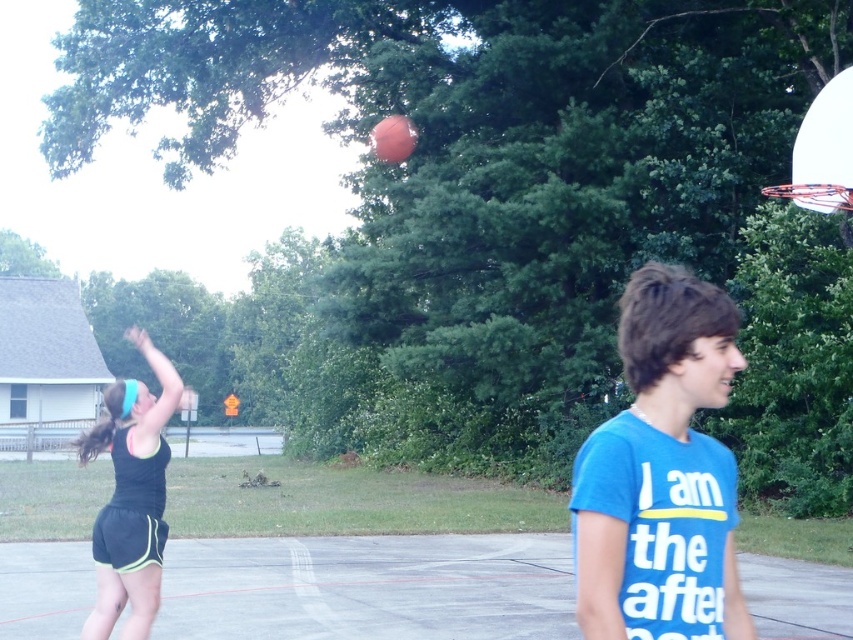
Is concrete court at center bigger than glossy orange basketball at upper center?

Yes.

Between point (566, 532) and point (369, 148), which one is positioned behind?

Point (369, 148)

Based on the photo, measure the distance between point (428, 550) and camera.

A distance of 15.06 meters exists between point (428, 550) and camera.

I want to click on concrete court at center, so click(x=369, y=588).

Who is taller, concrete court at center or white glossy basketball hoop at upper right?

concrete court at center is taller.

Between concrete court at center and white glossy basketball hoop at upper right, which one appears on the left side from the viewer's perspective?

concrete court at center

Identify the location of concrete court at center. (369, 588).

Is concrete court at center positioned behind blue cotton t-shirt at center?

Yes, concrete court at center is behind blue cotton t-shirt at center.

Is concrete court at center closer to the viewer compared to blue cotton t-shirt at center?

No, it is not.

Which is in front, point (453, 634) or point (697, 556)?

Point (697, 556)

The width and height of the screenshot is (853, 640). Find the location of `concrete court at center`. concrete court at center is located at coordinates (369, 588).